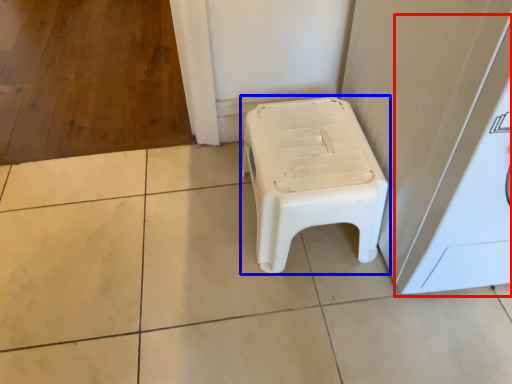
Question: Among these objects, which one is farthest to the camera, washing machine (highlighted by a red box) or stool (highlighted by a blue box)?

Choices:
 (A) washing machine
 (B) stool

Answer: (B)